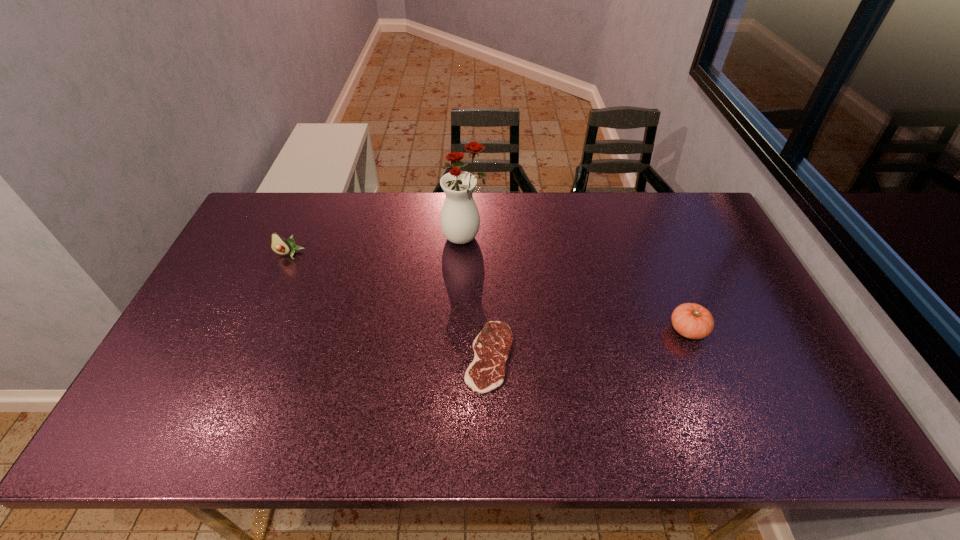
Where is `empty space that is in between the steak and the vase`? The width and height of the screenshot is (960, 540). empty space that is in between the steak and the vase is located at coordinates (477, 298).

Locate an element on the screen. This screenshot has height=540, width=960. vacant region between the second tallest object and the shortest object is located at coordinates (390, 306).

Where is `vacant space in between the avocado and the shortest object`? vacant space in between the avocado and the shortest object is located at coordinates (390, 306).

Locate an element on the screen. The height and width of the screenshot is (540, 960). free spot between the leftmost object and the shortest object is located at coordinates (390, 306).

The height and width of the screenshot is (540, 960). Identify the location of unoccupied position between the avocado and the vase. (377, 246).

Find the location of `empty space between the rightmost object and the leftmost object`. empty space between the rightmost object and the leftmost object is located at coordinates (489, 292).

This screenshot has width=960, height=540. Find the location of `blank region between the rightmost object and the avocado`. blank region between the rightmost object and the avocado is located at coordinates (489, 292).

At what (x,y) coordinates should I click in order to perform the action: click on object that is the second nearest to the second tallest object. Please return your answer as a coordinate pair (x, y). The height and width of the screenshot is (540, 960). Looking at the image, I should click on (492, 346).

This screenshot has height=540, width=960. Identify the location of object that ranks as the second closest to the tallest object. (279, 245).

In order to click on free space that satisfies the following two spatial constraints: 1. on the seed side of the rightmost object; 2. on the left side of the leftmost object in this screenshot , I will do `click(256, 330)`.